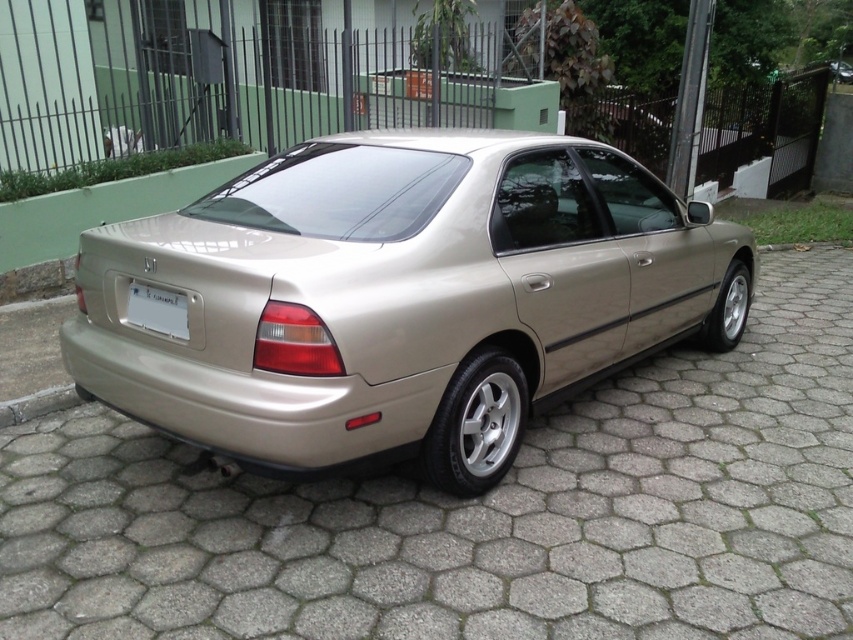
You are standing in front of a beige sedan parked on a hexagonal cobblestone driveway. You notice a point marked at coordinates (477, 513). Based on the scene, can you determine what object this point is located on?

The point at coordinates (477, 513) is located on the metallic gold car at center.

You are a delivery person trying to park your van behind the metallic gold car at center and the metallic gold sedan at center. You need to know which one is shorter to ensure clearance. Which vehicle is shorter?

The metallic gold car at center is not as tall as the metallic gold sedan at center, so the metallic gold car at center is shorter.

Consider the image. You are standing at the entrance of the driveway and want to park your car behind the metallic gold sedan at center. Based on the sedan position at point 0.464, 0.470, can you estimate if there is enough space to park your car behind it without crossing the driveway boundary?

The metallic gold sedan at center is located at point (399, 296). Since the driveway is hexagonal, there might be sufficient space depending on the angle and positioning. However, without specific measurements of the driveway dimensions or the distance between the car and the boundary, it is difficult to confirm if there is enough space to park behind it without crossing the boundary.